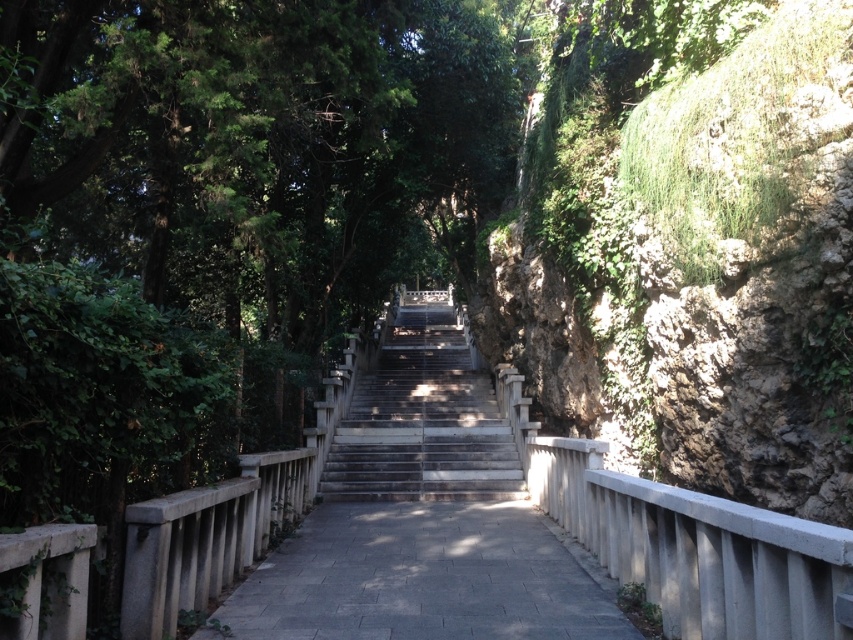
Question: Which object appears farthest from the camera in this image?

Choices:
 (A) gray concrete path at center
 (B) gray concrete stairs at center

Answer: (B)

Question: Estimate the real-world distances between objects in this image. Which object is farther from the gray concrete stairs at center?

Choices:
 (A) green leafy tree at center
 (B) gray concrete path at center

Answer: (A)

Question: Can you confirm if gray concrete path at center is positioned below gray concrete stairs at center?

Choices:
 (A) no
 (B) yes

Answer: (B)

Question: Does green mossy rock at right appear under gray concrete path at center?

Choices:
 (A) yes
 (B) no

Answer: (B)

Question: Is green mossy rock at right closer to the viewer compared to gray concrete path at center?

Choices:
 (A) yes
 (B) no

Answer: (A)

Question: Among these points, which one is nearest to the camera?

Choices:
 (A) (622, 636)
 (B) (486, 416)
 (C) (38, 170)
 (D) (619, 282)

Answer: (A)